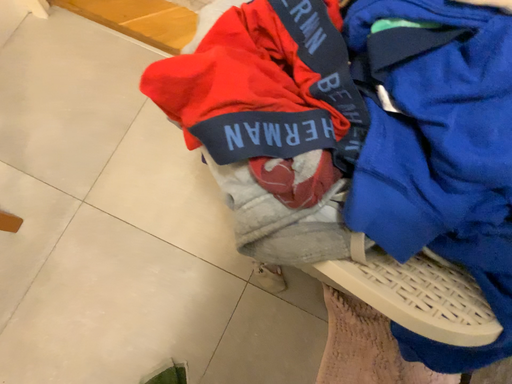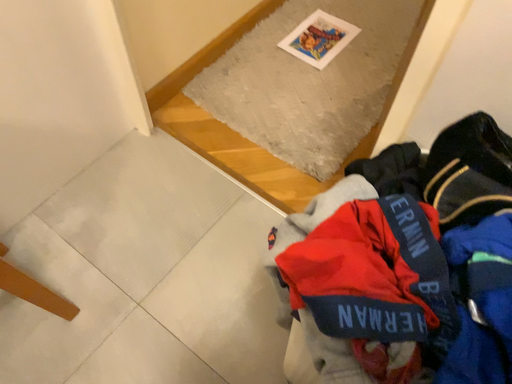
Question: Which way did the camera rotate in the video?

Choices:
 (A) rotated upward
 (B) rotated downward

Answer: (A)